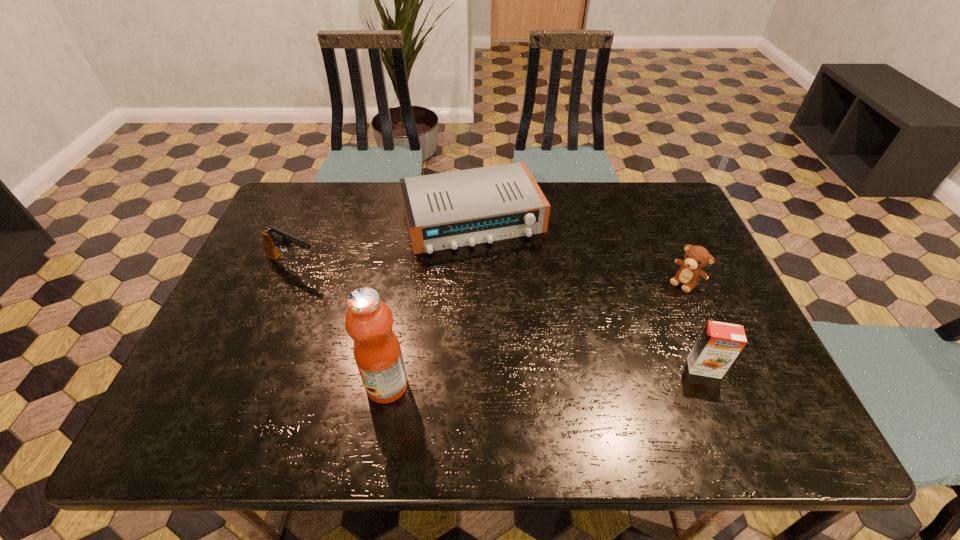
Find the location of a particular element. The width and height of the screenshot is (960, 540). orange juice that is at the near edge is located at coordinates (719, 344).

I want to click on object located in the left edge section of the desktop, so click(x=272, y=237).

Identify the location of orange juice situated at the right edge. This screenshot has height=540, width=960. 719,344.

Locate an element on the screen. teddy bear present at the right edge is located at coordinates (696, 257).

Find the location of a particular element. This screenshot has height=540, width=960. object located in the near right corner section of the desktop is located at coordinates click(x=719, y=344).

Locate an element on the screen. vacant area at the far edge of the desktop is located at coordinates (380, 190).

The width and height of the screenshot is (960, 540). Find the location of `vacant space at the near edge of the desktop`. vacant space at the near edge of the desktop is located at coordinates (467, 373).

Locate an element on the screen. The image size is (960, 540). vacant space at the left edge of the desktop is located at coordinates (238, 312).

The width and height of the screenshot is (960, 540). In the image, there is a desktop. In order to click on vacant space at the right edge in this screenshot , I will do `click(709, 290)`.

In the image, there is a desktop. Where is `vacant space at the near left corner`? vacant space at the near left corner is located at coordinates (250, 384).